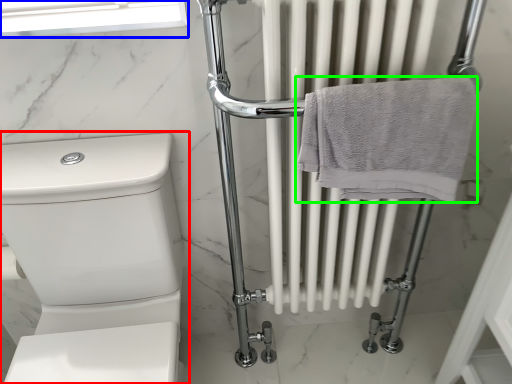
Question: Which object is the closest to the toilet (highlighted by a red box)? Choose among these: window screen (highlighted by a blue box) or towel (highlighted by a green box).

Choices:
 (A) window screen
 (B) towel

Answer: (A)